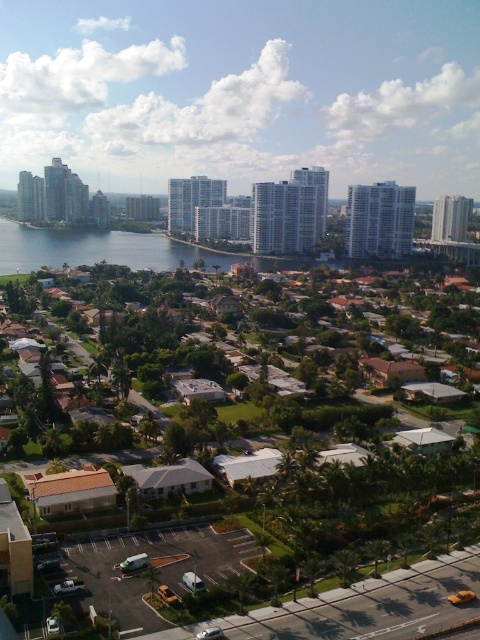
Is point (331, 557) farther from viewer compared to point (222, 252)?

No.

How distant is green grass at center from blue water at center?

green grass at center is 151.85 meters from blue water at center.

Between point (370, 481) and point (92, 236), which one is positioned behind?

The point (92, 236) is behind.

Find the location of a particular element. The width and height of the screenshot is (480, 640). green grass at center is located at coordinates (348, 506).